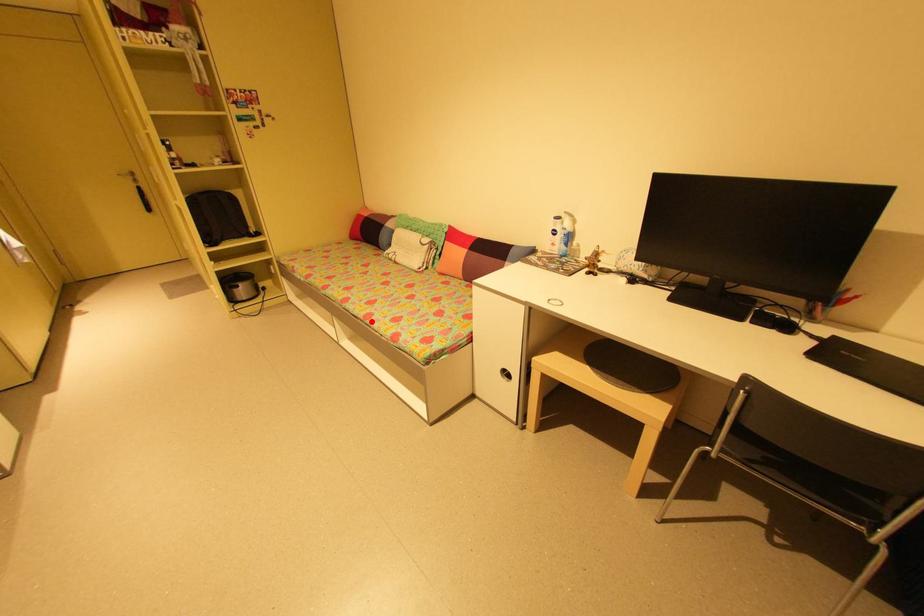
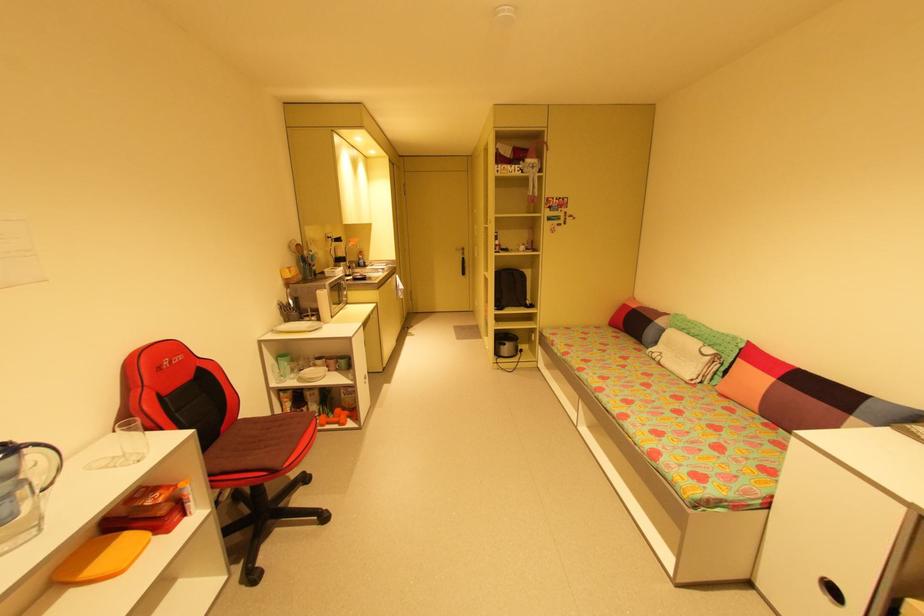
Question: A red point is marked in image1. In image2, is the corresponding 3D point closer to the camera or farther? Reply with the corresponding letter.

Choices:
 (A) The corresponding 3D point is closer.
 (B) The corresponding 3D point is farther.

Answer: (A)